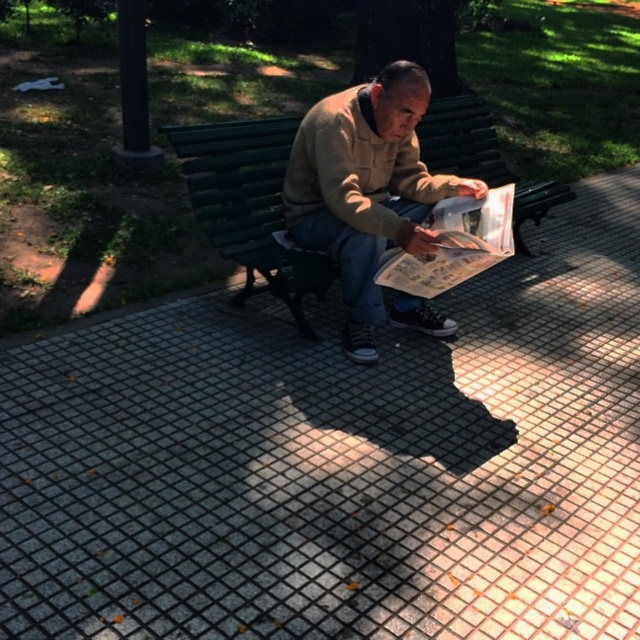
You are a park visitor who wants to sit on the green wood bench at center. However, there is a light brown suede jacket at center on the bench. Can you sit there without moving the jacket?

The light brown suede jacket at center is positioned over the green wood bench at center, so you cannot sit there without moving the jacket.

You are standing in the park and want to place a small flower pot at point (420,252). If your eyes are at 5 feet height, will the flower pot be visible to someone standing 6 feet away from you?

The distance of point (420,252) from viewer is 7.16 feet. Since the flower pot is placed at 7.16 feet away from you, someone standing 6 feet away from you would be closer to the original viewpoint and might not see the flower pot because it is further away than their position.